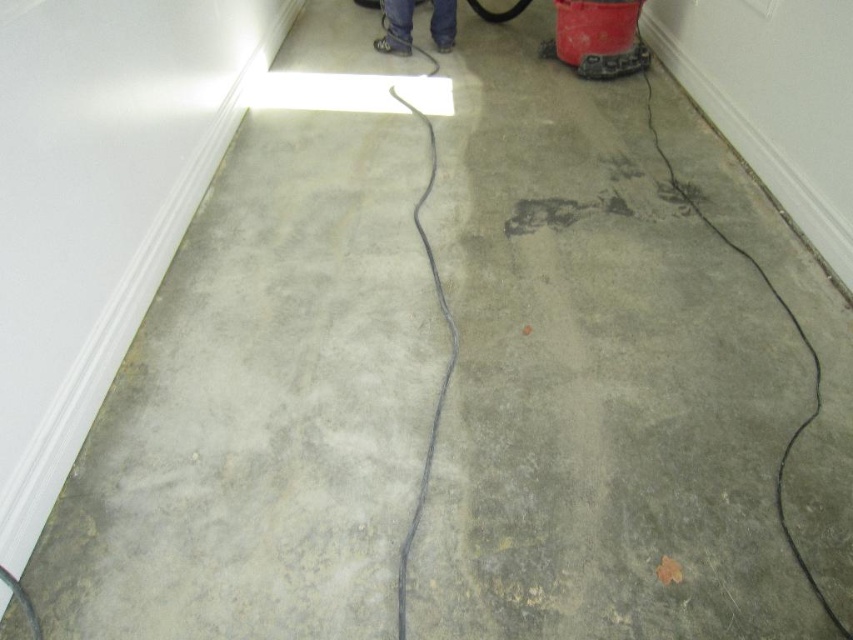
You are a maintenance worker who needs to place a 1.5 meter long safety tape between the gray concrete crack at lower right and the matte black shoes at center. Is there enough space to place the safety tape between them?

The distance between the gray concrete crack at lower right and the matte black shoes at center is 1.23 meters. Since the safety tape is 1.5 meters long, it is longer than the available space, so it cannot be placed between them.

You are a contractor inspecting the renovation site. You notice the gray concrete crack at lower right and the matte black shoes at center. Which object is located beneath the other?

The gray concrete crack at lower right is positioned under the matte black shoes at center.